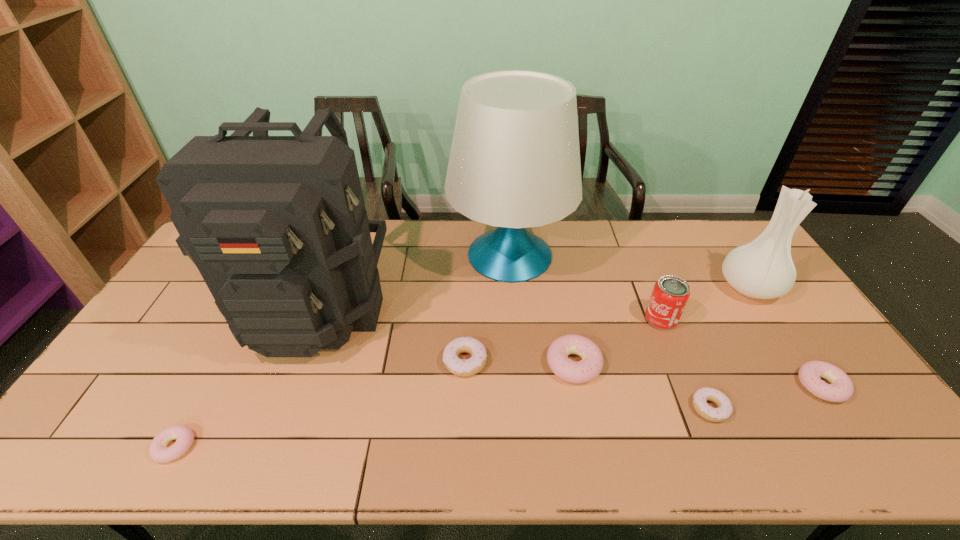
The image size is (960, 540). In order to click on doughnut that is the third closest to the rightmost pink doughnut in this screenshot , I will do `click(473, 365)`.

You are a GUI agent. You are given a task and a screenshot of the screen. Output one action in this format:
    pyautogui.click(x=<x>, y=<y>)
    Task: Click on the pink doughnut that stands as the second closest to the vase
    
    Given the screenshot: What is the action you would take?
    pyautogui.click(x=590, y=366)

Select which pink doughnut appears as the second closest to the left white doughnut. Please provide its 2D coordinates. Your answer should be formatted as a tuple, i.e. [(x, y)], where the tuple contains the x and y coordinates of a point satisfying the conditions above.

[(158, 450)]

Identify the location of free spot that satisfies the following two spatial constraints: 1. on the front side of the rightmost doughnut; 2. on the left side of the biggest pink doughnut. (578, 386).

This screenshot has width=960, height=540. Find the location of `free location that satisfies the following two spatial constraints: 1. on the front side of the farther white doughnut; 2. on the right side of the second smallest pink doughnut`. free location that satisfies the following two spatial constraints: 1. on the front side of the farther white doughnut; 2. on the right side of the second smallest pink doughnut is located at coordinates (465, 386).

Where is `vacant area in the image that satisfies the following two spatial constraints: 1. on the back side of the left white doughnut; 2. on the left side of the nearest object`? vacant area in the image that satisfies the following two spatial constraints: 1. on the back side of the left white doughnut; 2. on the left side of the nearest object is located at coordinates pyautogui.click(x=221, y=361).

Where is `free location that satisfies the following two spatial constraints: 1. on the front-facing side of the table lamp; 2. on the front compartment of the backpack`? The height and width of the screenshot is (540, 960). free location that satisfies the following two spatial constraints: 1. on the front-facing side of the table lamp; 2. on the front compartment of the backpack is located at coordinates (514, 306).